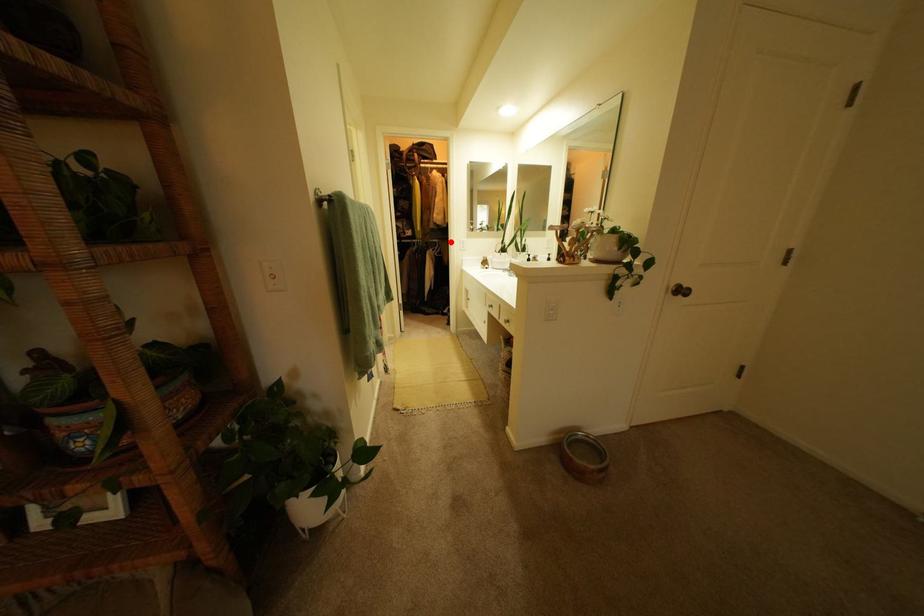
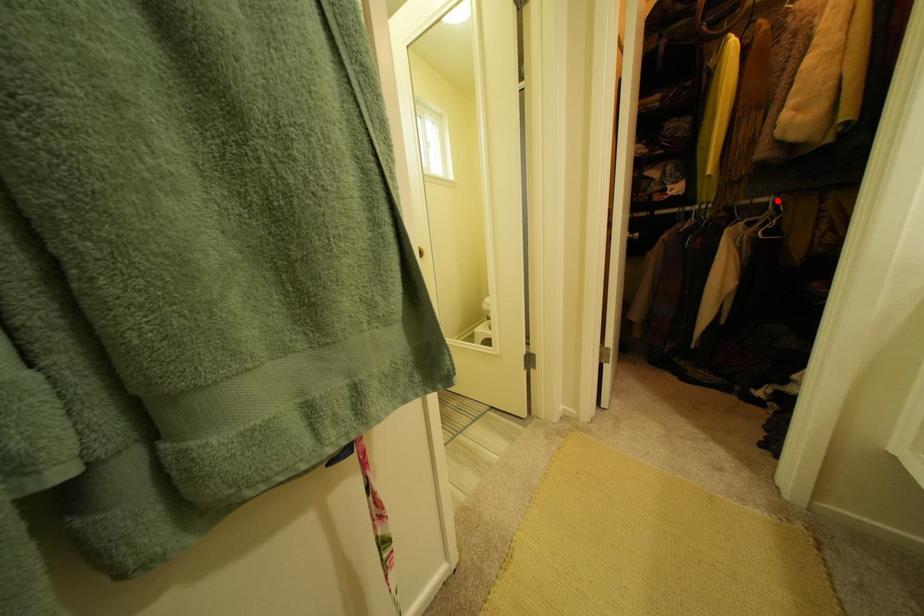
I am providing you with two images of the same scene from different viewpoints. A red point is marked on the first image and another point is marked on the second image. Does the point marked in image1 correspond to the same location as the one in image2?

Yes